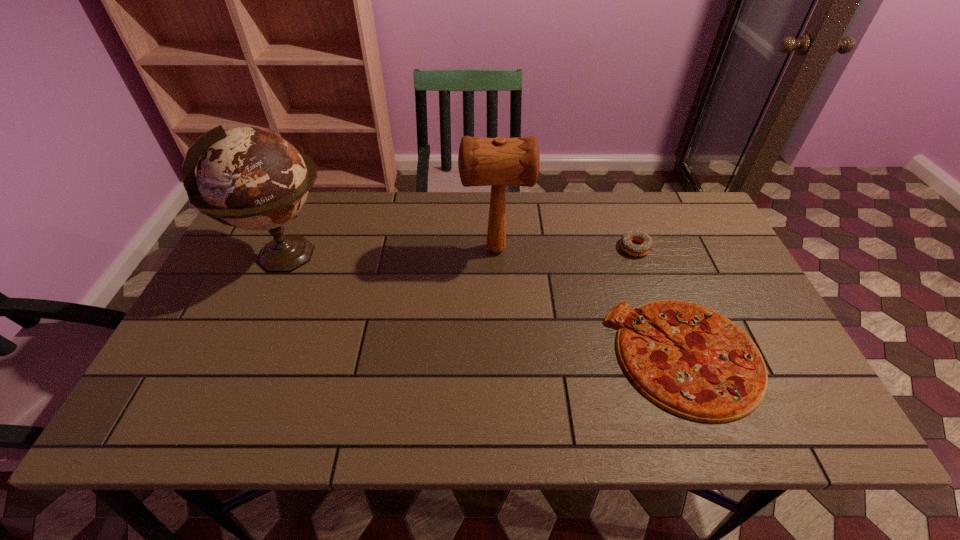
Find the location of a particular element. The width and height of the screenshot is (960, 540). the leftmost object is located at coordinates (251, 178).

This screenshot has width=960, height=540. In order to click on the second object from left to right in this screenshot , I will do `click(496, 162)`.

Where is `mallet`? This screenshot has height=540, width=960. mallet is located at coordinates (496, 162).

Where is `doughnut`? Image resolution: width=960 pixels, height=540 pixels. doughnut is located at coordinates (645, 240).

Locate an element on the screen. This screenshot has width=960, height=540. the nearest object is located at coordinates (717, 374).

Find the location of a particular element. the shortest object is located at coordinates (717, 374).

Where is `free space located 0.170m on the front of the globe showing Asia`? Image resolution: width=960 pixels, height=540 pixels. free space located 0.170m on the front of the globe showing Asia is located at coordinates (397, 256).

At what (x,y) coordinates should I click in order to perform the action: click on free space located 0.250m on the strike surface of the third shortest object. Please return your answer as a coordinate pair (x, y). The width and height of the screenshot is (960, 540). Looking at the image, I should click on (376, 249).

Find the location of a particular element. Image resolution: width=960 pixels, height=540 pixels. free location located 0.330m on the strike surface of the third shortest object is located at coordinates (349, 249).

Locate an element on the screen. The width and height of the screenshot is (960, 540). vacant area located 0.220m on the strike surface of the third shortest object is located at coordinates (387, 249).